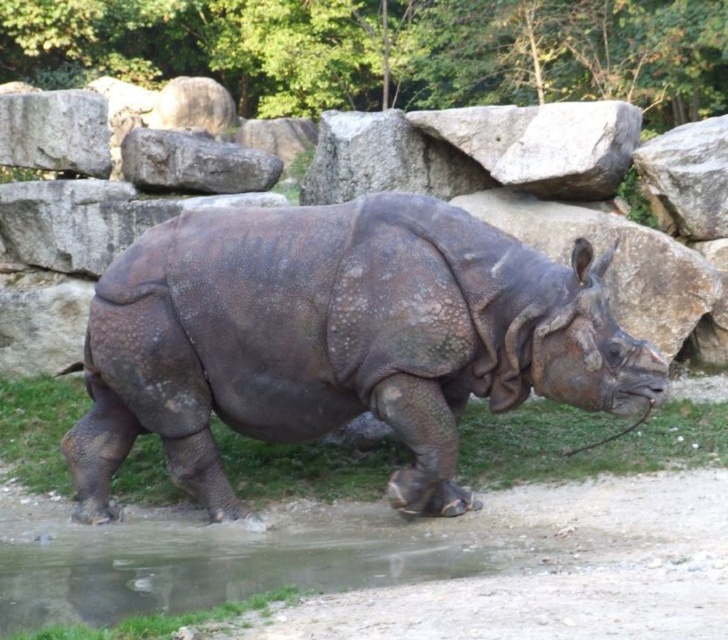
Question: Is dark brown textured rhinoceros at center wider than transparent wet ground at lower center?

Choices:
 (A) no
 (B) yes

Answer: (B)

Question: Is dark brown textured rhinoceros at center smaller than transparent wet ground at lower center?

Choices:
 (A) no
 (B) yes

Answer: (A)

Question: Does dark brown textured rhinoceros at center have a larger size compared to transparent wet ground at lower center?

Choices:
 (A) no
 (B) yes

Answer: (B)

Question: Which point is farther to the camera?

Choices:
 (A) transparent wet ground at lower center
 (B) dark brown textured rhinoceros at center

Answer: (B)